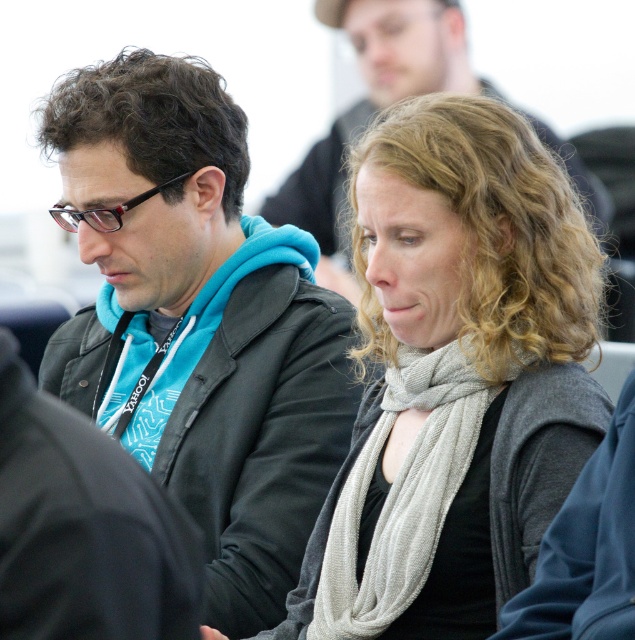
Question: Is matte black jacket at left positioned in front of light gray scarf at center?

Choices:
 (A) no
 (B) yes

Answer: (A)

Question: From the image, what is the correct spatial relationship of light gray scarf at center in relation to gray knitted scarf at center?

Choices:
 (A) right
 (B) left

Answer: (A)

Question: Which object appears closest to the camera in this image?

Choices:
 (A) matte black jacket at center
 (B) light gray scarf at center
 (C) matte black jacket at left
 (D) gray knitted scarf at center

Answer: (B)

Question: Which point is farther to the camera?

Choices:
 (A) matte black jacket at left
 (B) gray knitted scarf at center

Answer: (A)

Question: Among these objects, which one is nearest to the camera?

Choices:
 (A) light gray scarf at center
 (B) matte black jacket at left
 (C) gray knitted scarf at center

Answer: (A)

Question: Can you confirm if matte black jacket at left is wider than matte black jacket at center?

Choices:
 (A) yes
 (B) no

Answer: (A)